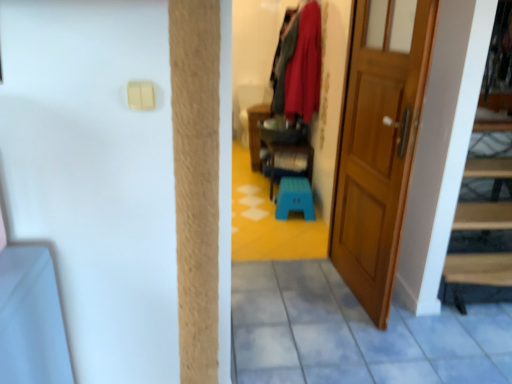
Image resolution: width=512 pixels, height=384 pixels. I want to click on vacant space to the left of wooden door at right, so click(275, 302).